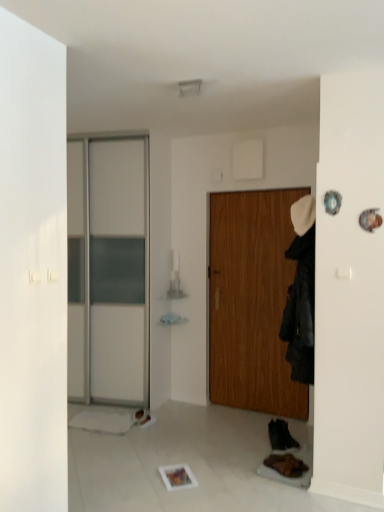
Question: Is brown suede shoe at lower right, placed as the 1th shoe when sorted from front to back, behind white leather shoe at lower center, which ranks as the 1th shoe in left-to-right order?

Choices:
 (A) yes
 (B) no

Answer: (B)

Question: From the image's perspective, is brown suede shoe at lower right, the 2th shoe from the left, on white leather shoe at lower center, which ranks as the 1th shoe in left-to-right order?

Choices:
 (A) yes
 (B) no

Answer: (B)

Question: Is brown suede shoe at lower right, the 2th shoe from the left, turned away from white leather shoe at lower center, the third shoe when ordered from right to left?

Choices:
 (A) no
 (B) yes

Answer: (A)

Question: Does brown suede shoe at lower right, placed as the 1th shoe when sorted from front to back, have a larger size compared to white leather shoe at lower center, which ranks as the 1th shoe in back-to-front order?

Choices:
 (A) no
 (B) yes

Answer: (B)

Question: From the image's perspective, does brown suede shoe at lower right, marked as the third shoe in a back-to-front arrangement, appear lower than white leather shoe at lower center, which ranks as the 1th shoe in back-to-front order?

Choices:
 (A) no
 (B) yes

Answer: (B)

Question: Does brown suede shoe at lower right, placed as the 1th shoe when sorted from front to back, have a greater width compared to white leather shoe at lower center, the 3th shoe positioned from the front?

Choices:
 (A) yes
 (B) no

Answer: (A)

Question: Is wooden door at center smaller than black leather shoe at lower right, the 1th shoe from the right?

Choices:
 (A) yes
 (B) no

Answer: (B)

Question: Is wooden door at center in contact with black leather shoe at lower right, the 1th shoe from the right?

Choices:
 (A) yes
 (B) no

Answer: (B)

Question: From a real-world perspective, is wooden door at center over black leather shoe at lower right, which ranks as the 2th shoe in front-to-back order?

Choices:
 (A) yes
 (B) no

Answer: (A)

Question: Is wooden door at center thinner than black leather shoe at lower right, arranged as the second shoe when viewed from the back?

Choices:
 (A) yes
 (B) no

Answer: (A)

Question: Is the depth of wooden door at center greater than that of black leather shoe at lower right, arranged as the second shoe when viewed from the back?

Choices:
 (A) yes
 (B) no

Answer: (A)

Question: Is wooden door at center wider than black leather shoe at lower right, the 1th shoe from the right?

Choices:
 (A) yes
 (B) no

Answer: (B)

Question: Does wooden door at center appear on the left side of black fabric coat at right?

Choices:
 (A) yes
 (B) no

Answer: (A)